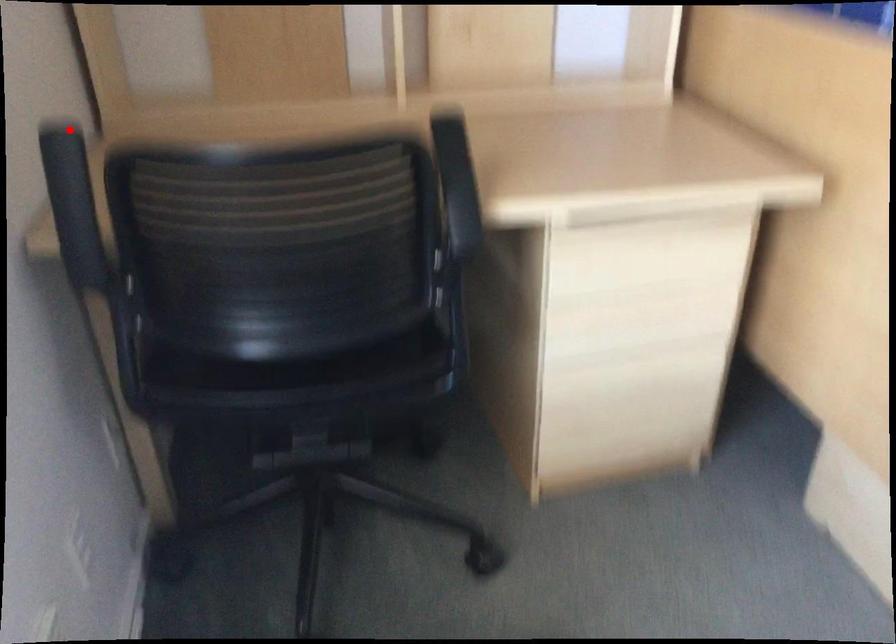
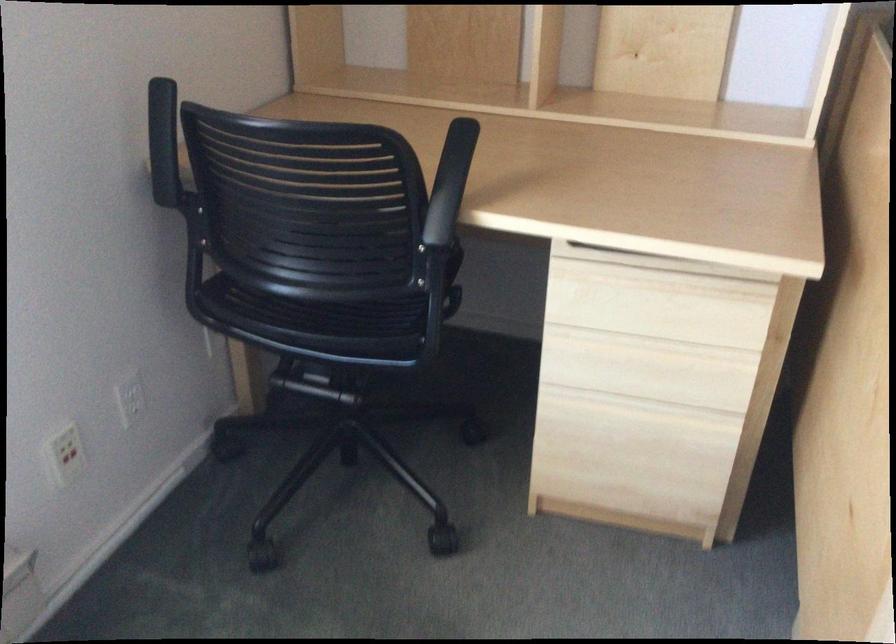
Question: A red point is marked in image1. In image2, is the corresponding 3D point closer to the camera or farther? Reply with the corresponding letter.

Choices:
 (A) The corresponding 3D point is closer.
 (B) The corresponding 3D point is farther.

Answer: (B)